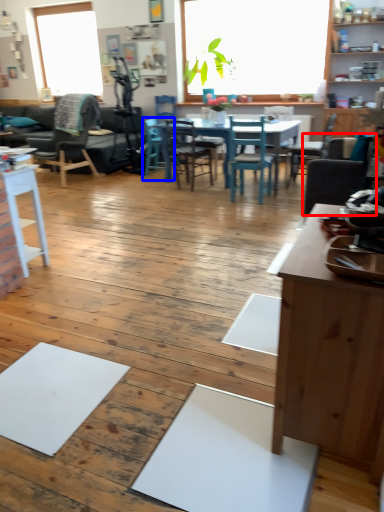
Question: Which object appears closest to the camera in this image, chair (highlighted by a red box) or chair (highlighted by a blue box)?

Choices:
 (A) chair
 (B) chair

Answer: (A)